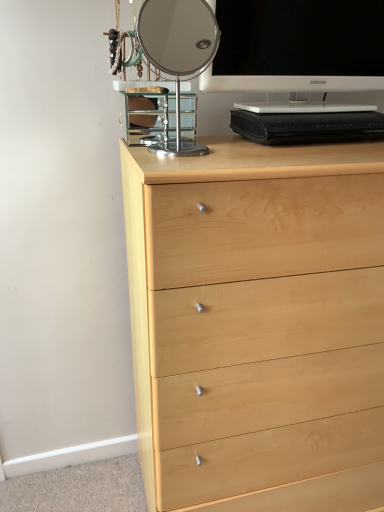
Question: Do you think white glossy television at upper right is within polished chrome mirror at upper center, or outside of it?

Choices:
 (A) outside
 (B) inside

Answer: (A)

Question: Considering the positions of white glossy television at upper right and polished chrome mirror at upper center in the image, is white glossy television at upper right wider or thinner than polished chrome mirror at upper center?

Choices:
 (A) thin
 (B) wide

Answer: (B)

Question: Estimate the real-world distances between objects in this image. Which object is closer to the light wood chest of drawers at center?

Choices:
 (A) natural wood drawer at lower center
 (B) white glossy television at upper right
 (C) polished chrome mirror at upper center

Answer: (A)

Question: Estimate the real-world distances between objects in this image. Which object is farther from the light wood chest of drawers at center?

Choices:
 (A) natural wood drawer at lower center
 (B) polished chrome mirror at upper center
 (C) white glossy television at upper right

Answer: (B)